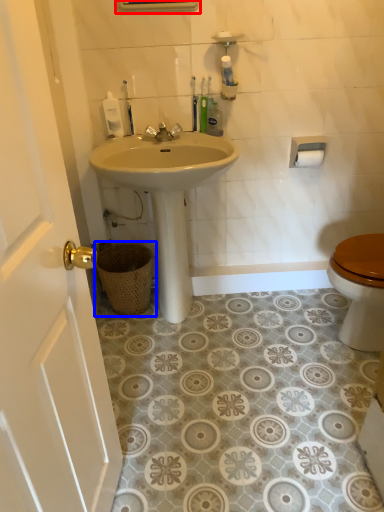
Question: Which object appears farthest to the camera in this image, medicine cabinet (highlighted by a red box) or basket (highlighted by a blue box)?

Choices:
 (A) medicine cabinet
 (B) basket

Answer: (B)